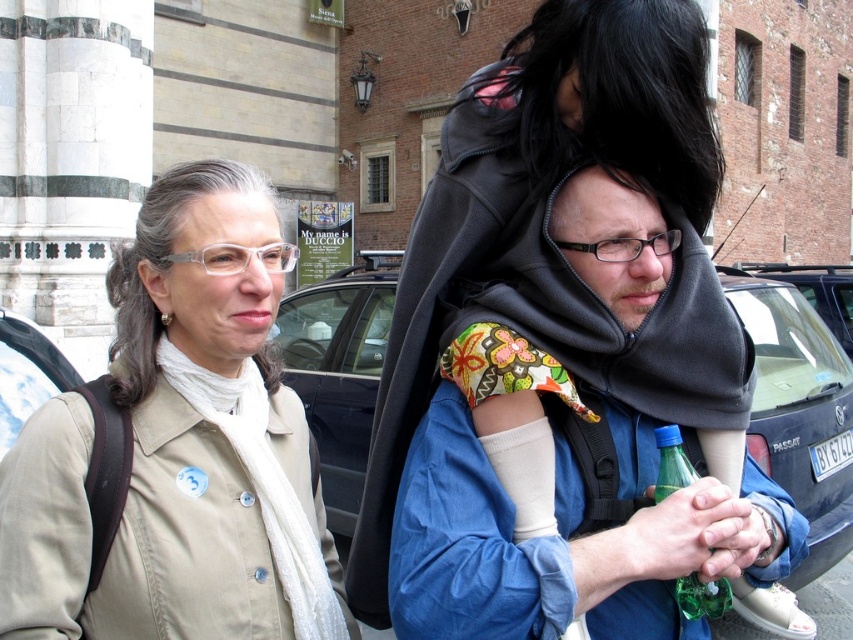
You are standing in the urban setting shown in the image. There are two points marked as point 1 at coordinates (84, 435) and point 2 at coordinates (316, 340). Which point is closer to you?

Point 1 at coordinates (84, 435) is closer to you than point 2 at coordinates (316, 340).

You are a photographer trying to capture the entire scene in one shot. The beige fabric jacket at upper left and the blue matte car at center are in your frame. Considering their sizes in the image, which one will appear smaller?

The beige fabric jacket at upper left appears smaller than the blue matte car at center because it is thinner in the image.

From the picture: You are a photographer trying to capture the beige fabric jacket at upper left. The camera you are using has a zoom lens that can focus on objects within a 0.5 unit radius. Given that the point provided is at coordinate (180, 445), will the beige fabric jacket at upper left be within the camera focus range?

The point (180, 445) indicates the beige fabric jacket at upper left, so the camera can focus on it as it is within the 0.5 unit radius.